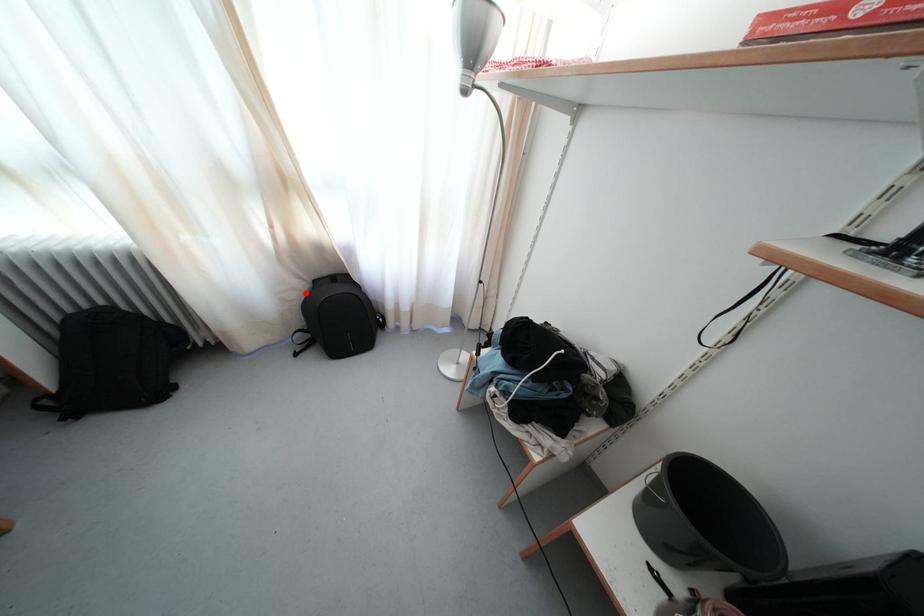
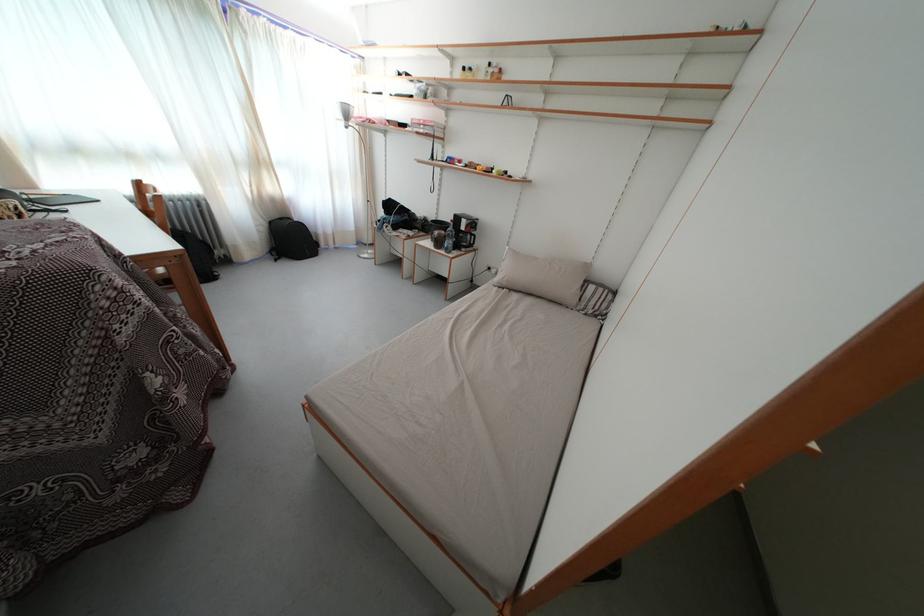
Question: I am providing you with two images of the same scene from different viewpoints. In image1, a red point is highlighted. Considering the same 3D point in image2, which of the following is correct?

Choices:
 (A) It is closer
 (B) It is farther

Answer: (A)